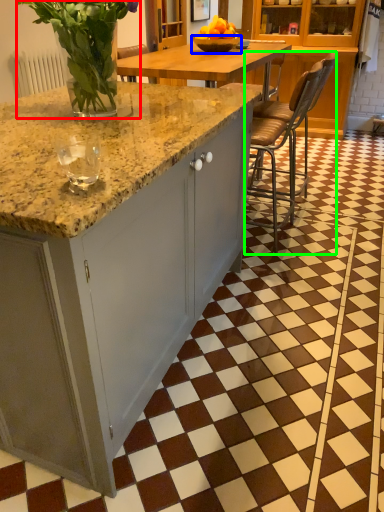
Question: Which object is the closest to the floral arrangement (highlighted by a red box)? Choose among these: bowl (highlighted by a blue box) or chair (highlighted by a green box).

Choices:
 (A) bowl
 (B) chair

Answer: (A)